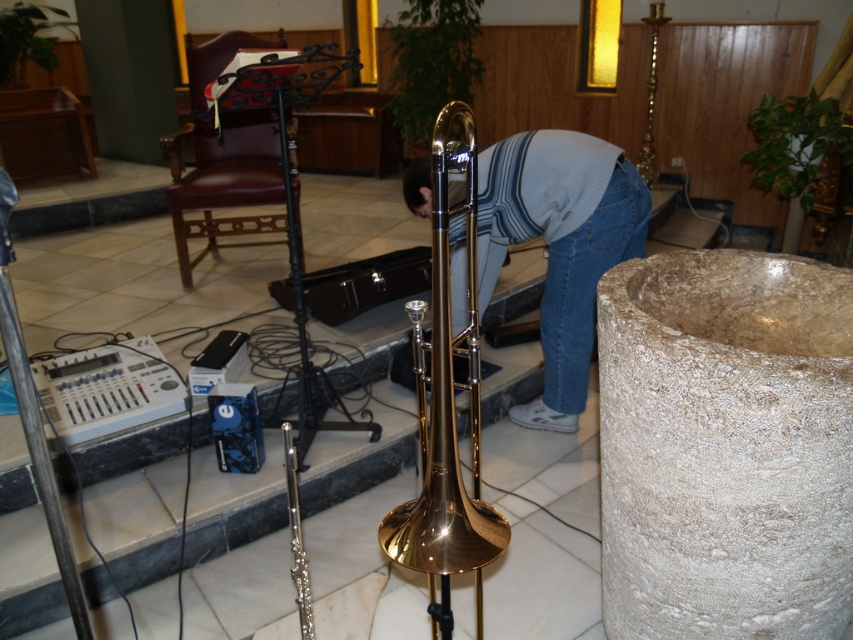
Based on the photo, you are a photographer setting up for a photoshoot in the venue. You have a striped sweater at center and a gold polished trombone at center. Which object should you focus on first if you want to capture the larger item in your frame?

The striped sweater at center is larger in size than the gold polished trombone at center, so you should focus on the striped sweater at center first to capture the larger item in your frame.

You are a musician who needs to reach the gold polished trombone at center from where you are standing next to the striped sweater at center. Can you grab it without moving your feet?

The striped sweater at center and gold polished trombone at center are 30.69 inches apart, so yes, you can grab the gold polished trombone at center without moving your feet since the distance is within reach.

You are a photographer setting up for a baptism ceremony. You need to position your camera so that both the baptismal font on the right and the brass trombone on the left are in focus. Given that the baptismal font is at point (473, 476) and the brass trombone is at point (573, 307), which object is closer to the camera? This will help determine your focus settings.

Point (573, 307) is closer to the camera than point (473, 476). Therefore, the brass trombone at point (573, 307) is closer to the camera than the baptismal font at point (473, 476).